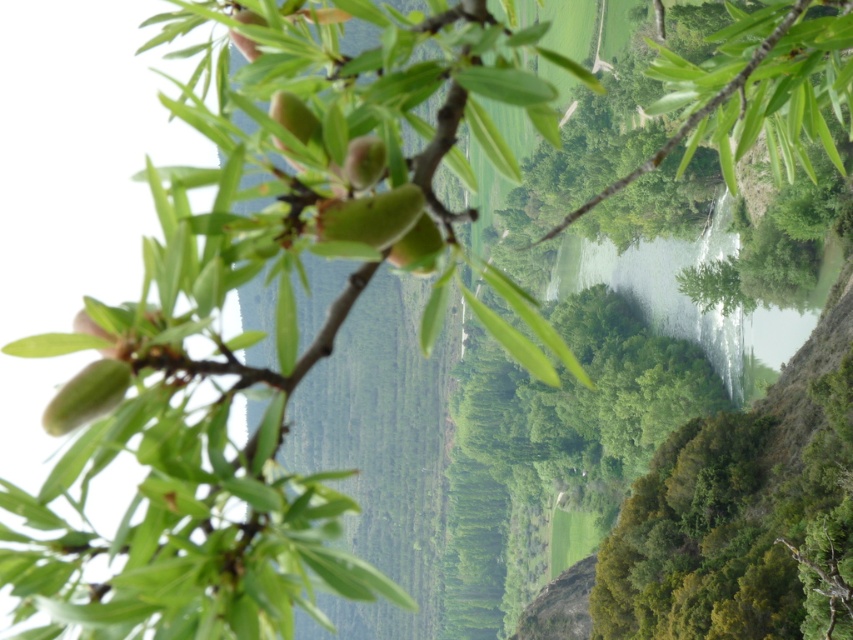
Can you confirm if green matte leaves at center is bigger than green leafy branch at center?

No, green matte leaves at center is not bigger than green leafy branch at center.

Consider the image. Between green matte leaves at center and green leafy branch at center, which one appears on the right side from the viewer's perspective?

From the viewer's perspective, green leafy branch at center appears more on the right side.

Where is `green matte leaves at center`? green matte leaves at center is located at coordinates (273, 312).